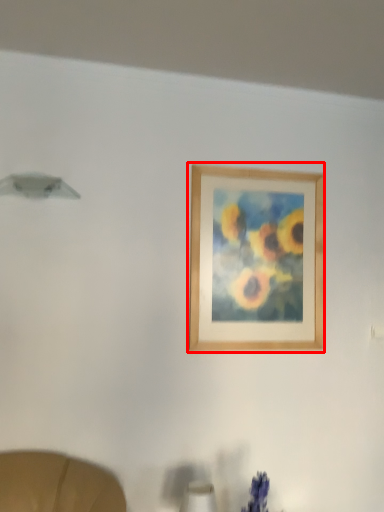
Question: Considering the relative positions of picture frame (annotated by the red box) and table lamp in the image provided, where is picture frame (annotated by the red box) located with respect to the staircase?

Choices:
 (A) right
 (B) left

Answer: (A)